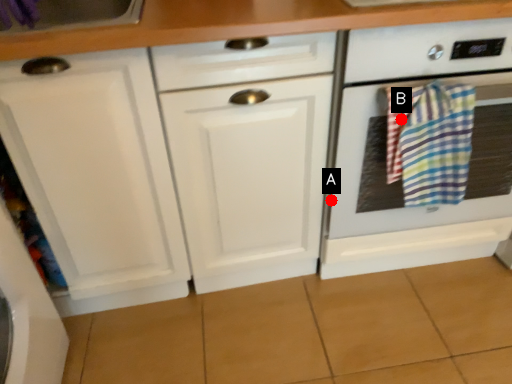
Question: Two points are circled on the image, labeled by A and B beside each circle. Among these points, which one is farthest from the camera?

Choices:
 (A) A is further
 (B) B is further

Answer: (A)